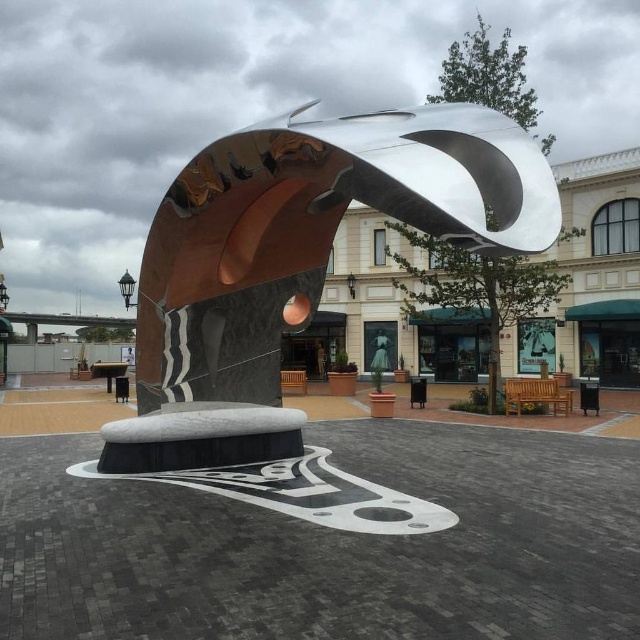
Describe the element at coordinates (298, 260) in the screenshot. This screenshot has width=640, height=640. I see `polished metal sculpture at center` at that location.

Between polished metal sculpture at center and polished silver sculpture at center, which one is positioned higher?

polished metal sculpture at center is higher up.

Find the location of a particular element. The image size is (640, 640). polished metal sculpture at center is located at coordinates (298, 260).

The width and height of the screenshot is (640, 640). Find the location of `polished metal sculpture at center`. polished metal sculpture at center is located at coordinates (298, 260).